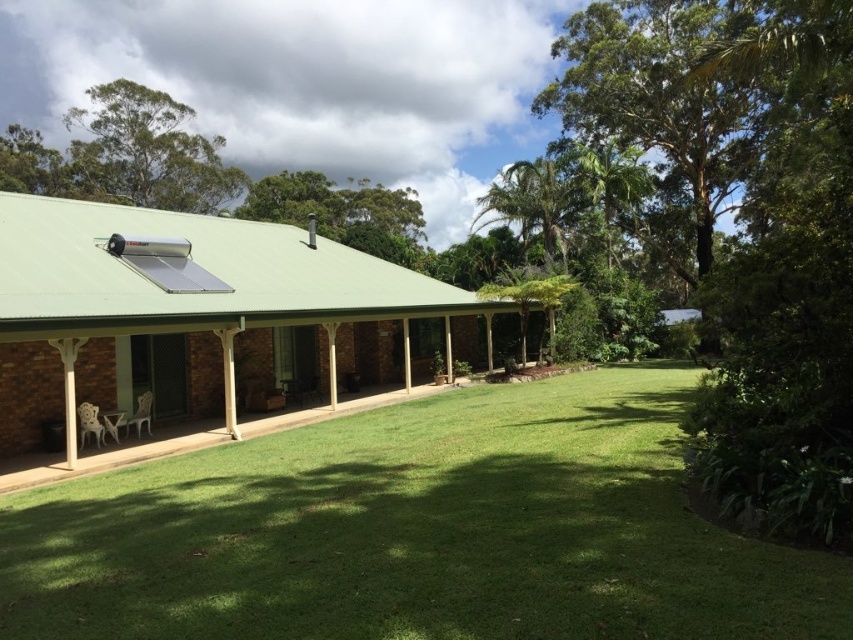
Question: From the image, what is the correct spatial relationship of green grass at center in relation to white plastic chairs at lower left?

Choices:
 (A) below
 (B) above

Answer: (B)

Question: Which of the following is the closest to the observer?

Choices:
 (A) green grass at center
 (B) white plastic chairs at lower left

Answer: (A)

Question: Is green grass at center to the right of white plastic chairs at lower left from the viewer's perspective?

Choices:
 (A) yes
 (B) no

Answer: (A)

Question: Which of the following is the closest to the observer?

Choices:
 (A) (322, 570)
 (B) (80, 474)

Answer: (A)

Question: Considering the relative positions of green grass at center and white plastic chairs at lower left in the image provided, where is green grass at center located with respect to white plastic chairs at lower left?

Choices:
 (A) right
 (B) left

Answer: (A)